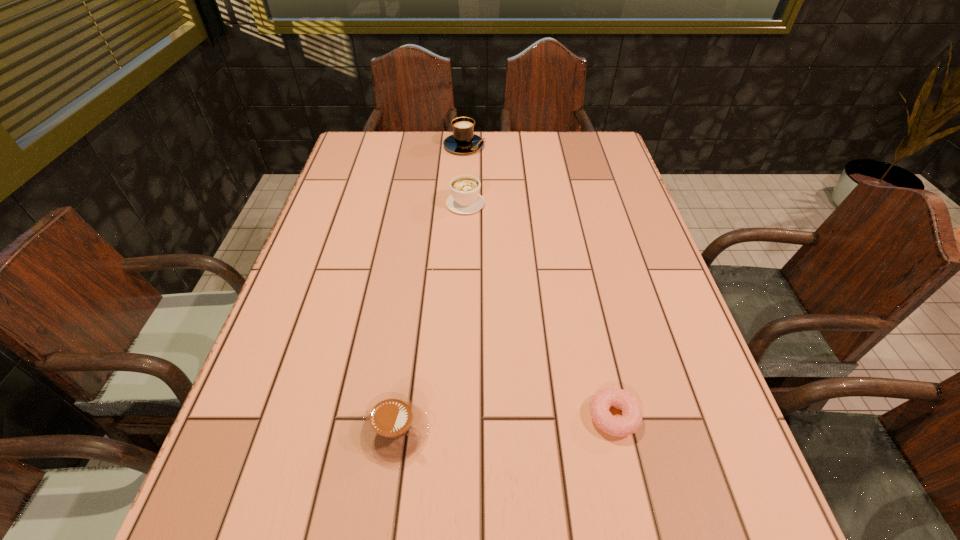
This screenshot has width=960, height=540. I want to click on unoccupied position between the second farthest object and the rightmost object, so (x=540, y=309).

Locate an element on the screen. This screenshot has height=540, width=960. free spot between the nearest cappuccino and the second nearest cappuccino is located at coordinates (430, 316).

Where is `free space between the farthest object and the nearest cappuccino`? free space between the farthest object and the nearest cappuccino is located at coordinates (429, 288).

Find the location of a particular element. The width and height of the screenshot is (960, 540). free spot between the second nearest cappuccino and the farthest cappuccino is located at coordinates (465, 174).

The width and height of the screenshot is (960, 540). I want to click on free space between the farthest cappuccino and the doughnut, so click(540, 281).

In order to click on vacant space that's between the second nearest cappuccino and the nearest cappuccino in this screenshot , I will do `click(430, 316)`.

Where is `free space between the farthest cappuccino and the second nearest cappuccino`? Image resolution: width=960 pixels, height=540 pixels. free space between the farthest cappuccino and the second nearest cappuccino is located at coordinates (465, 174).

Where is `vacant point located between the tallest object and the third nearest object`? vacant point located between the tallest object and the third nearest object is located at coordinates (465, 174).

Where is `vacant area that lies between the farthest object and the nearest cappuccino`? The image size is (960, 540). vacant area that lies between the farthest object and the nearest cappuccino is located at coordinates (429, 288).

Identify which object is the second closest to the tallest object. Please provide its 2D coordinates. Your answer should be formatted as a tuple, i.e. [(x, y)], where the tuple contains the x and y coordinates of a point satisfying the conditions above.

[(394, 427)]